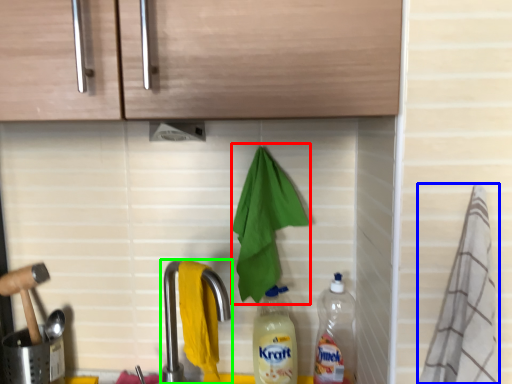
Question: Which object is the farthest from hand towel (highlighted by a red box)? Choose among these: material (highlighted by a blue box) or tap (highlighted by a green box).

Choices:
 (A) material
 (B) tap

Answer: (A)